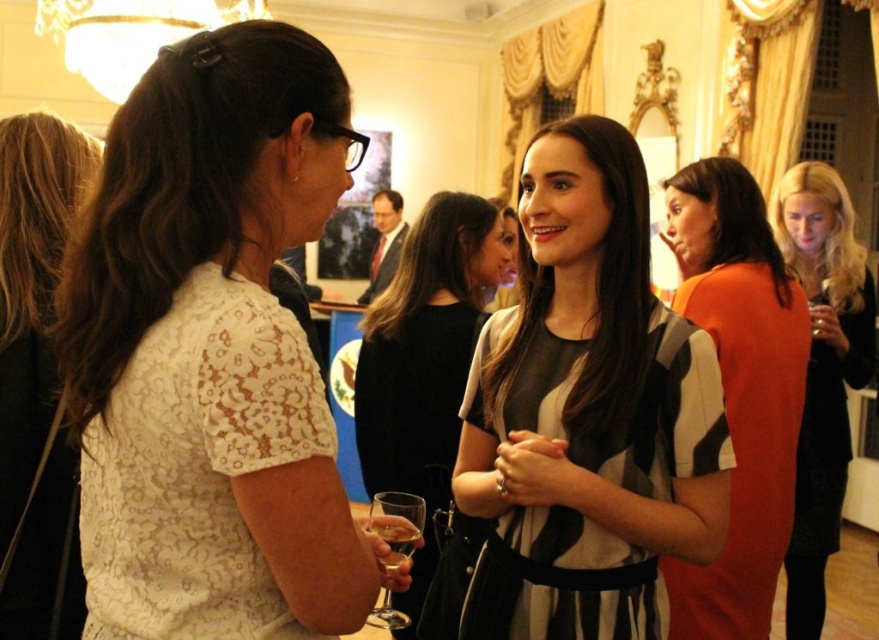
You are a photographer at the event and need to capture both the white lace dress at left and the lace fabric dress at left in a single shot. Which dress should you position closer to the left side of the frame to ensure both are visible?

The white lace dress at left is already positioned to the left of the lace fabric dress at left, so positioning it closer to the left side of the frame would maintain their natural arrangement while ensuring both are visible in the shot.

You are at a party and see two items in the scene. One is the white lace dress at left and the other is the clear glass wine glass at lower center. Which of these two items is positioned to the left of the other?

The white lace dress at left is positioned to the left of the clear glass wine glass at lower center.

Consider the image. You are a photographer positioned at the entrance of the room. You want to take a photo that includes both the white lace dress at left and the lace fabric dress at left. Which dress should you adjust your camera angle to focus on first to ensure both are in frame?

The white lace dress at left is closer to you, so you should focus on it first to ensure both dresses are in frame.